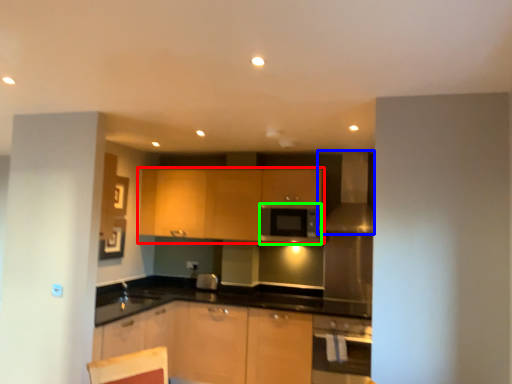
Question: Which object is the closest to the cabinetry (highlighted by a red box)? Choose among these: exhaust hood (highlighted by a blue box) or appliance (highlighted by a green box).

Choices:
 (A) exhaust hood
 (B) appliance

Answer: (B)